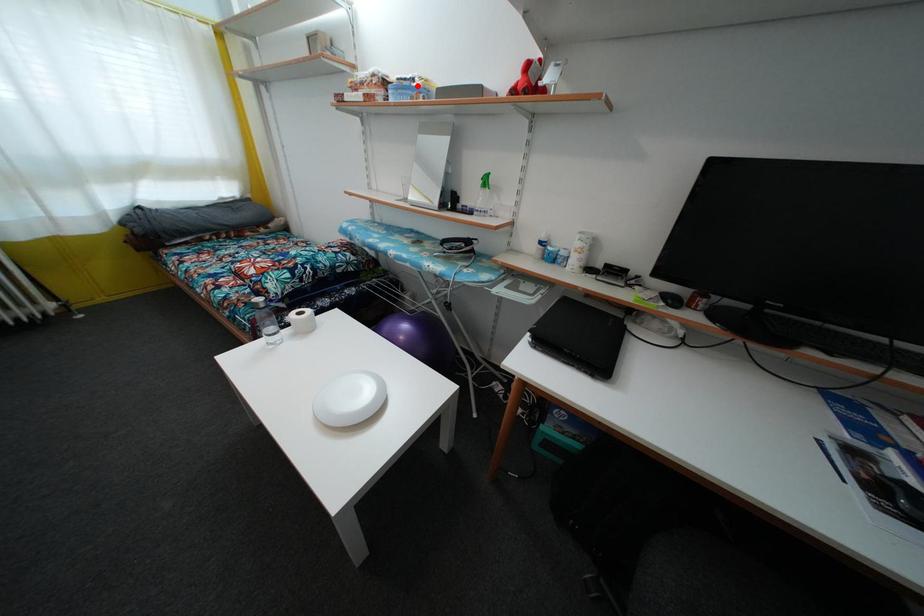
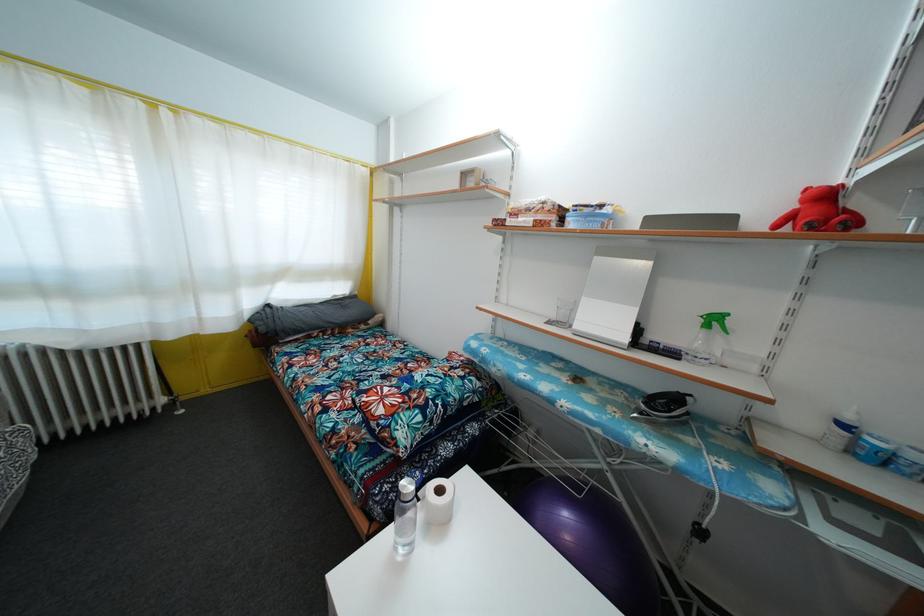
Locate, in the second image, the point that corresponds to the highlighted location in the first image.

(605, 213)